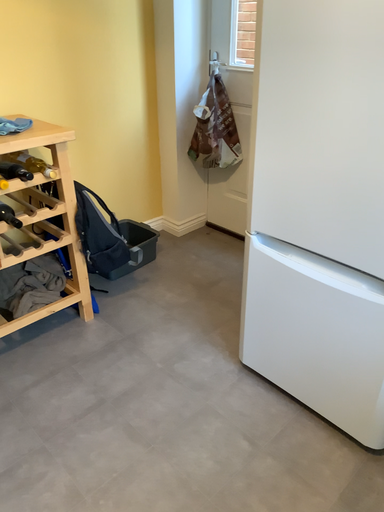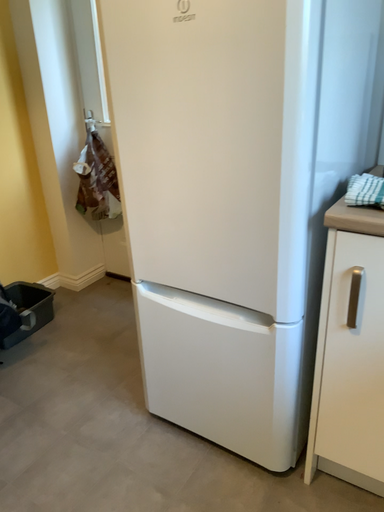
Question: Which way did the camera rotate in the video?

Choices:
 (A) rotated downward
 (B) rotated upward

Answer: (B)